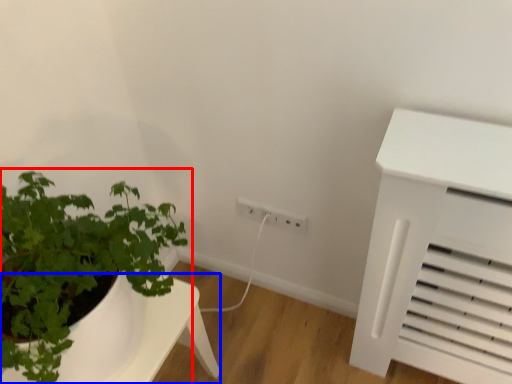
Question: Which object is further to the camera taking this photo, houseplant (highlighted by a red box) or table (highlighted by a blue box)?

Choices:
 (A) houseplant
 (B) table

Answer: (B)